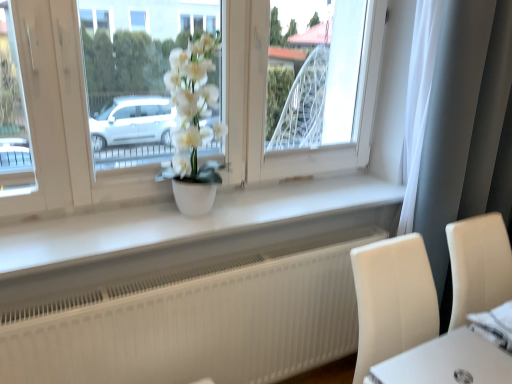
Question: Is white fabric at lower right surrounding white matte pot at center?

Choices:
 (A) no
 (B) yes

Answer: (A)

Question: From the image's perspective, would you say white fabric at lower right is positioned over white matte pot at center?

Choices:
 (A) yes
 (B) no

Answer: (B)

Question: From a real-world perspective, is white fabric at lower right located beneath white matte pot at center?

Choices:
 (A) no
 (B) yes

Answer: (B)

Question: Is white fabric at lower right oriented towards white matte pot at center?

Choices:
 (A) no
 (B) yes

Answer: (A)

Question: Is white fabric at lower right not close to white matte pot at center?

Choices:
 (A) yes
 (B) no

Answer: (A)

Question: From a real-world perspective, is white fabric at lower right physically located above or below white matte window sill at center?

Choices:
 (A) below
 (B) above

Answer: (A)

Question: Does point (494, 339) appear closer or farther from the camera than point (135, 220)?

Choices:
 (A) closer
 (B) farther

Answer: (A)

Question: Considering the positions of white fabric at lower right and white matte window sill at center in the image, is white fabric at lower right wider or thinner than white matte window sill at center?

Choices:
 (A) thin
 (B) wide

Answer: (A)

Question: Based on their sizes in the image, would you say white fabric at lower right is bigger or smaller than white matte window sill at center?

Choices:
 (A) small
 (B) big

Answer: (A)

Question: Is white matte pot at center wider or thinner than white fabric at lower right?

Choices:
 (A) wide
 (B) thin

Answer: (B)

Question: Does point (175, 175) appear closer or farther from the camera than point (478, 326)?

Choices:
 (A) closer
 (B) farther

Answer: (B)

Question: Considering the relative positions of white matte pot at center and white fabric at lower right in the image provided, is white matte pot at center to the left or to the right of white fabric at lower right?

Choices:
 (A) left
 (B) right

Answer: (A)

Question: Considering their positions, is white matte pot at center located in front of or behind white fabric at lower right?

Choices:
 (A) behind
 (B) front

Answer: (A)

Question: Considering the positions of white fabric at lower right and white glossy round table at lower right in the image, is white fabric at lower right taller or shorter than white glossy round table at lower right?

Choices:
 (A) tall
 (B) short

Answer: (B)

Question: In terms of size, does white fabric at lower right appear bigger or smaller than white glossy round table at lower right?

Choices:
 (A) small
 (B) big

Answer: (B)